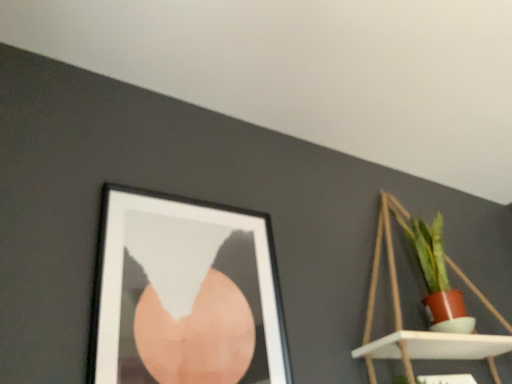
Question: Is matte wooden shelf at upper right positioned far away from black matte picture frame at upper left?

Choices:
 (A) yes
 (B) no

Answer: (B)

Question: From the image's perspective, is matte wooden shelf at upper right over black matte picture frame at upper left?

Choices:
 (A) no
 (B) yes

Answer: (A)

Question: Does matte wooden shelf at upper right have a smaller size compared to black matte picture frame at upper left?

Choices:
 (A) no
 (B) yes

Answer: (A)

Question: Is matte wooden shelf at upper right positioned with its back to black matte picture frame at upper left?

Choices:
 (A) yes
 (B) no

Answer: (B)

Question: From a real-world perspective, does matte wooden shelf at upper right stand above black matte picture frame at upper left?

Choices:
 (A) no
 (B) yes

Answer: (B)

Question: From the image's perspective, would you say matte wooden shelf at upper right is shown under black matte picture frame at upper left?

Choices:
 (A) yes
 (B) no

Answer: (A)

Question: Considering the relative positions of black matte picture frame at upper left and matte wooden shelf at upper right in the image provided, is black matte picture frame at upper left behind matte wooden shelf at upper right?

Choices:
 (A) no
 (B) yes

Answer: (A)

Question: Is black matte picture frame at upper left to the left of matte wooden shelf at upper right from the viewer's perspective?

Choices:
 (A) no
 (B) yes

Answer: (B)

Question: Does black matte picture frame at upper left have a lesser width compared to matte wooden shelf at upper right?

Choices:
 (A) no
 (B) yes

Answer: (B)

Question: Could you tell me if black matte picture frame at upper left is turned towards matte wooden shelf at upper right?

Choices:
 (A) no
 (B) yes

Answer: (A)

Question: From the image's perspective, does black matte picture frame at upper left appear lower than matte wooden shelf at upper right?

Choices:
 (A) no
 (B) yes

Answer: (A)

Question: Can you confirm if black matte picture frame at upper left is smaller than matte wooden shelf at upper right?

Choices:
 (A) no
 (B) yes

Answer: (B)

Question: From a real-world perspective, relative to matte wooden shelf at upper right, is black matte picture frame at upper left vertically above or below?

Choices:
 (A) above
 (B) below

Answer: (B)